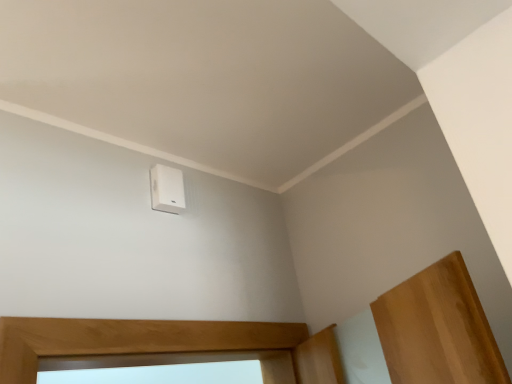
Locate an element on the screen. This screenshot has width=512, height=384. white plastic light switch at upper center is located at coordinates (167, 189).

The image size is (512, 384). Describe the element at coordinates (167, 189) in the screenshot. I see `white plastic light switch at upper center` at that location.

Find the location of a particular element. The image size is (512, 384). white plastic light switch at upper center is located at coordinates (167, 189).